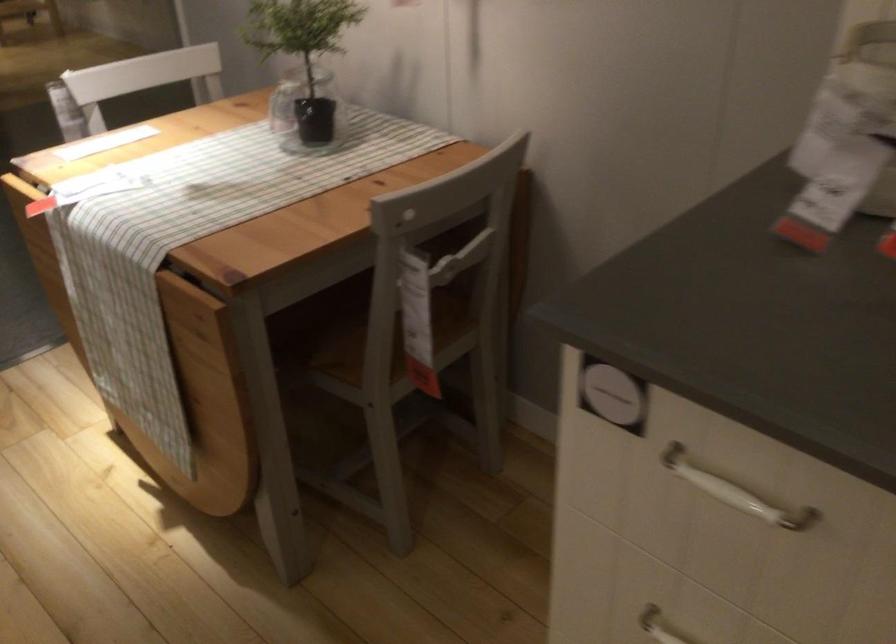
Locate an element on the screen. This screenshot has height=644, width=896. chair sitting surface is located at coordinates (x=351, y=337).